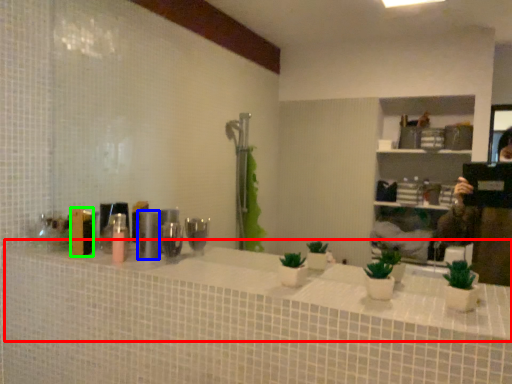
Question: Based on their relative distances, which object is farther from counter top (highlighted by a red box)? Choose from toiletry (highlighted by a blue box) and toiletry (highlighted by a green box).

Choices:
 (A) toiletry
 (B) toiletry

Answer: (B)